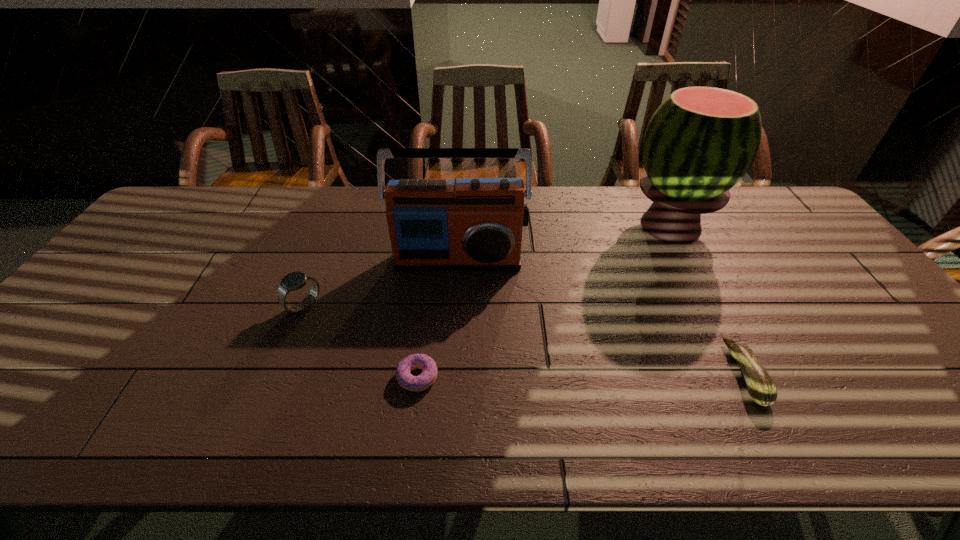
At what (x,y) coordinates should I click in order to perform the action: click on free space between the radio receiver and the third farthest object. Please return your answer as a coordinate pair (x, y). Looking at the image, I should click on (381, 282).

The width and height of the screenshot is (960, 540). What are the coordinates of `object identified as the closest to the third farthest object` in the screenshot? It's located at (465, 224).

Choose which object is the fourth nearest neighbor to the third shortest object. Please provide its 2D coordinates. Your answer should be formatted as a tuple, i.e. [(x, y)], where the tuple contains the x and y coordinates of a point satisfying the conditions above.

[(761, 388)]